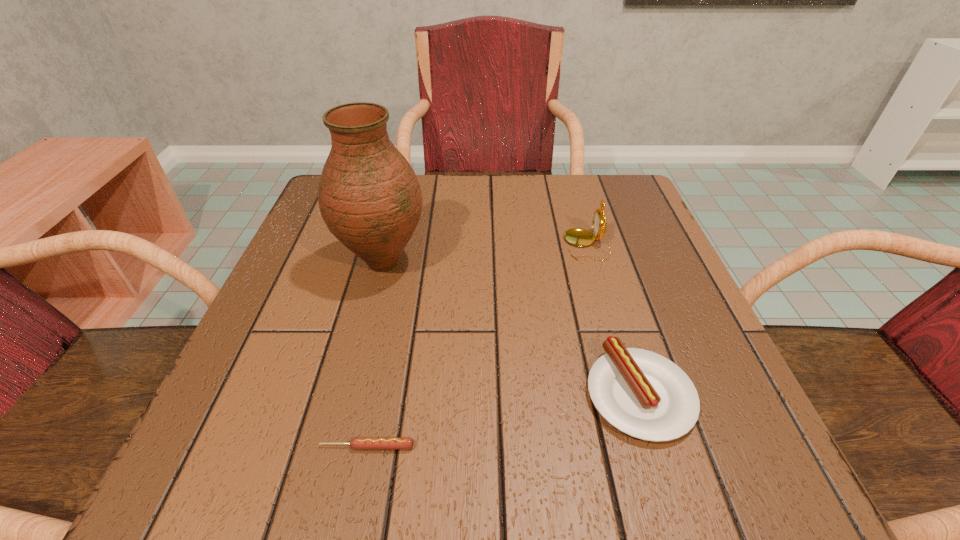
This screenshot has width=960, height=540. I want to click on vase, so click(369, 197).

This screenshot has width=960, height=540. Identify the location of the third shortest object. (580, 237).

This screenshot has width=960, height=540. I want to click on the taller sausage, so click(641, 393).

Find the location of a particular element. This screenshot has width=960, height=540. the right sausage is located at coordinates (641, 393).

This screenshot has width=960, height=540. In order to click on the left sausage in this screenshot , I will do pos(358,443).

Identify the location of the shorter sausage. This screenshot has width=960, height=540. (358, 443).

Find the location of `vacant region located on the back of the tallest object`. vacant region located on the back of the tallest object is located at coordinates (400, 195).

Where is `free space located on the face of the third shortest object`? The width and height of the screenshot is (960, 540). free space located on the face of the third shortest object is located at coordinates (462, 245).

Identify the location of free spot located 0.060m on the face of the third shortest object. The image size is (960, 540). point(536,245).

This screenshot has width=960, height=540. I want to click on free location located on the face of the third shortest object, so click(477, 245).